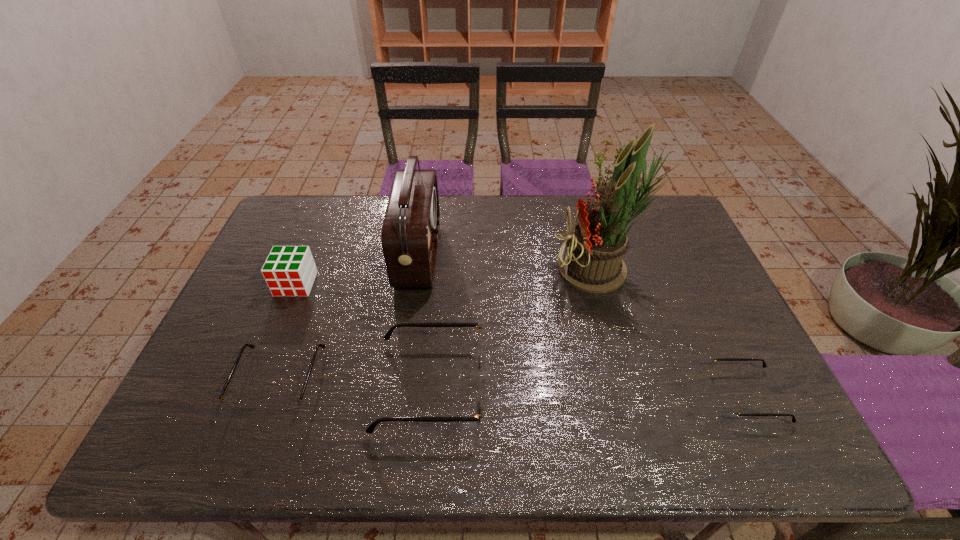
Where is `unoccupied position between the second shortest spectacles and the second tallest object`? unoccupied position between the second shortest spectacles and the second tallest object is located at coordinates (349, 318).

Locate an element on the screen. Image resolution: width=960 pixels, height=540 pixels. vacant area between the third tallest object and the tallest object is located at coordinates (448, 277).

Where is `object that is the third closest to the fourth tallest object`? The width and height of the screenshot is (960, 540). object that is the third closest to the fourth tallest object is located at coordinates (591, 260).

Where is `object that can be found as the fifth closest to the radio receiver`? Image resolution: width=960 pixels, height=540 pixels. object that can be found as the fifth closest to the radio receiver is located at coordinates (729, 407).

Where is `spectacles that is the second closest to the shortest object`? The height and width of the screenshot is (540, 960). spectacles that is the second closest to the shortest object is located at coordinates (284, 405).

Identify which spectacles is the second closest to the second shortest spectacles. Please provide its 2D coordinates. Your answer should be formatted as a tuple, i.e. [(x, y)], where the tuple contains the x and y coordinates of a point satisfying the conditions above.

[(729, 407)]